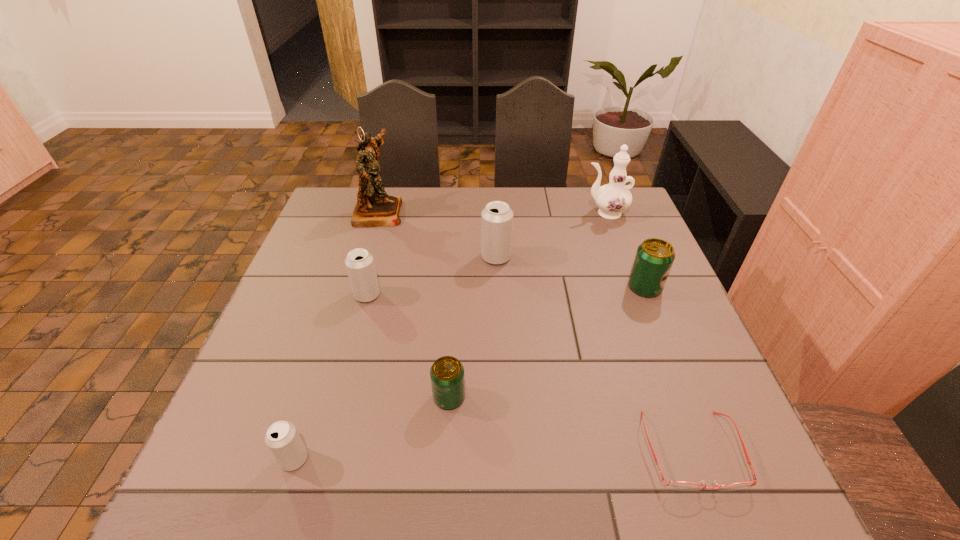
Identify the location of vacant space that is in between the smallest white beer can and the fourth beer can from left to right. (396, 358).

The width and height of the screenshot is (960, 540). Identify the location of free point between the fifth object from right to left and the nearest white beer can. (372, 428).

Identify the location of free space between the nearest white beer can and the second tallest object. This screenshot has width=960, height=540. (449, 336).

Where is `free space between the second farthest white beer can and the nearest white beer can`? The width and height of the screenshot is (960, 540). free space between the second farthest white beer can and the nearest white beer can is located at coordinates (330, 377).

Identify the location of empty space between the tallest object and the farthest beer can. The width and height of the screenshot is (960, 540). (438, 234).

Where is `vacant space that's between the sixth nearest object and the second farthest white beer can`? This screenshot has height=540, width=960. vacant space that's between the sixth nearest object and the second farthest white beer can is located at coordinates 432,276.

You are a GUI agent. You are given a task and a screenshot of the screen. Output one action in this format:
    pyautogui.click(x=<x>, y=<y>)
    Task: Click on the free point between the nearest white beer can and the third tallest object
    
    Given the screenshot: What is the action you would take?
    pyautogui.click(x=396, y=358)

At what (x,y) coordinates should I click in order to perform the action: click on free spot between the gold figurine and the smallest white beer can. Please return your answer as a coordinate pair (x, y). The width and height of the screenshot is (960, 540). Looking at the image, I should click on (337, 335).

I want to click on empty space that is in between the fifth object from left to right and the figurine, so click(438, 234).

You are a GUI agent. You are given a task and a screenshot of the screen. Output one action in this format:
    pyautogui.click(x=<x>, y=<y>)
    Task: Click on the vacant point located between the farthest white beer can and the chinaware
    
    Given the screenshot: What is the action you would take?
    pyautogui.click(x=550, y=235)